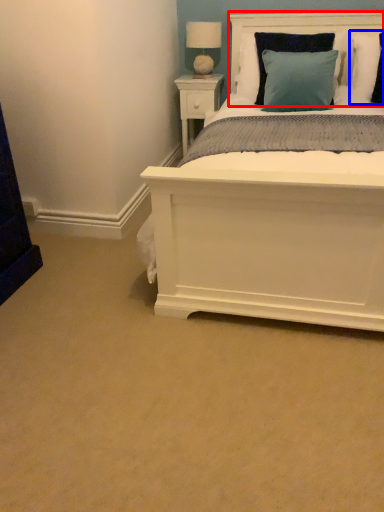
Question: Which object is closer to the camera taking this photo, headboard (highlighted by a red box) or pillow (highlighted by a blue box)?

Choices:
 (A) headboard
 (B) pillow

Answer: (B)